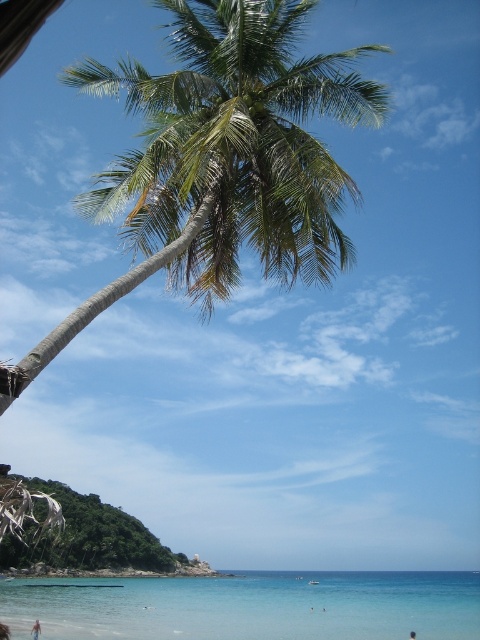
Looking at this image, which is more to the right, clear blue water at lower center or black hair at lower center?

black hair at lower center

Who is positioned more to the left, clear blue water at lower center or black hair at lower center?

From the viewer's perspective, clear blue water at lower center appears more on the left side.

What do you see at coordinates (248, 605) in the screenshot?
I see `clear blue water at lower center` at bounding box center [248, 605].

Locate an element on the screen. This screenshot has width=480, height=640. clear blue water at lower center is located at coordinates (248, 605).

Can you confirm if green leafy palm tree at upper center is thinner than black hair at lower center?

In fact, green leafy palm tree at upper center might be wider than black hair at lower center.

Consider the image. Which is above, green leafy palm tree at upper center or black hair at lower center?

Positioned higher is green leafy palm tree at upper center.

Who is more forward, (224,138) or (409,632)?

Point (224,138) is in front.

Find the location of `green leafy palm tree at upper center`. green leafy palm tree at upper center is located at coordinates (226, 156).

The width and height of the screenshot is (480, 640). What do you see at coordinates (226, 156) in the screenshot? I see `green leafy palm tree at upper center` at bounding box center [226, 156].

What do you see at coordinates (226, 156) in the screenshot? The image size is (480, 640). I see `green leafy palm tree at upper center` at bounding box center [226, 156].

Identify the location of green leafy palm tree at upper center. (226, 156).